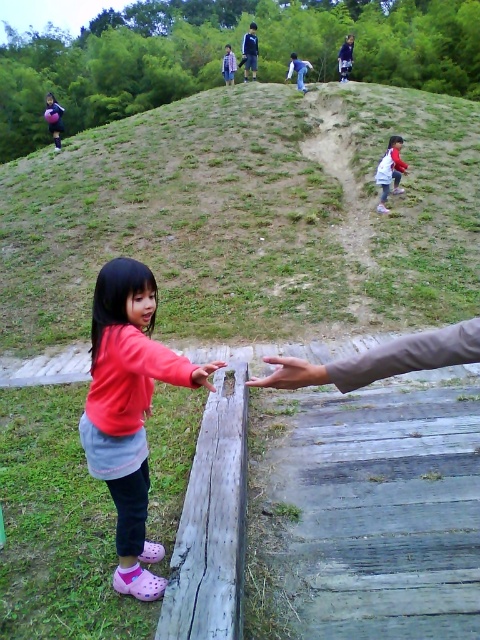
Between point (391, 140) and point (291, 52), which one is positioned in front?

Point (391, 140)

Between point (385, 193) and point (299, 83), which one is positioned behind?

The point (299, 83) is more distant.

This screenshot has width=480, height=640. In order to click on matte pink hoodie at upper right in this screenshot , I will do `click(389, 172)`.

The height and width of the screenshot is (640, 480). What do you see at coordinates (346, 58) in the screenshot? I see `dark blue denim jacket at upper center` at bounding box center [346, 58].

Does dark blue denim jacket at upper center have a greater width compared to smooth wooden hand at lower center?

Yes.

Which is behind, point (348, 60) or point (214, 371)?

Positioned behind is point (348, 60).

At what (x,y) coordinates should I click in order to perform the action: click on dark blue denim jacket at upper center. Please return your answer as a coordinate pair (x, y). The width and height of the screenshot is (480, 640). Looking at the image, I should click on (346, 58).

Does pink rubber shoes at lower left have a lesser width compared to pink fabric dress at lower left?

Indeed, pink rubber shoes at lower left has a lesser width compared to pink fabric dress at lower left.

Consider the image. Can you confirm if pink rubber shoes at lower left is smaller than pink fabric dress at lower left?

Correct, pink rubber shoes at lower left occupies less space than pink fabric dress at lower left.

Which is in front, point (87, 440) or point (50, 106)?

Point (87, 440) is more forward.

The image size is (480, 640). Find the location of `pink rubber shoes at lower left`. pink rubber shoes at lower left is located at coordinates (127, 410).